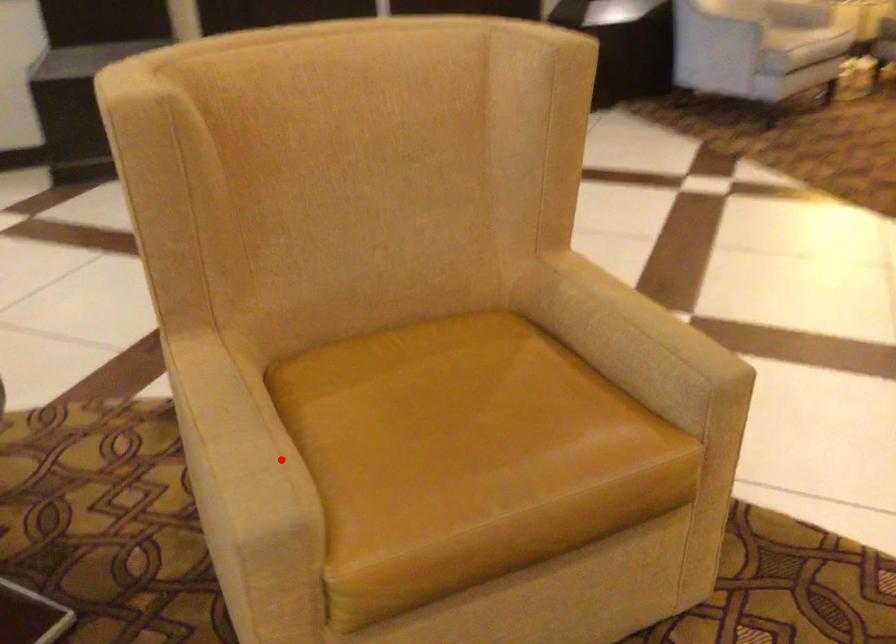
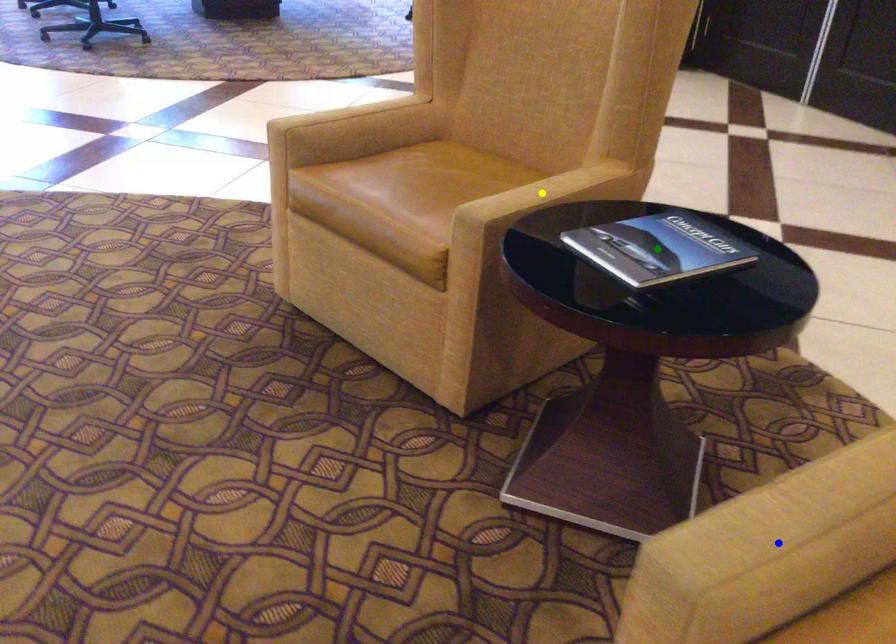
Question: I am providing you with two images of the same scene from different viewpoints. A red point is marked on the first image. You are given multiple points on the second image. In image 2, which mark is for the same physical point as the one in image 1?

Choices:
 (A) green point
 (B) blue point
 (C) yellow point

Answer: (B)